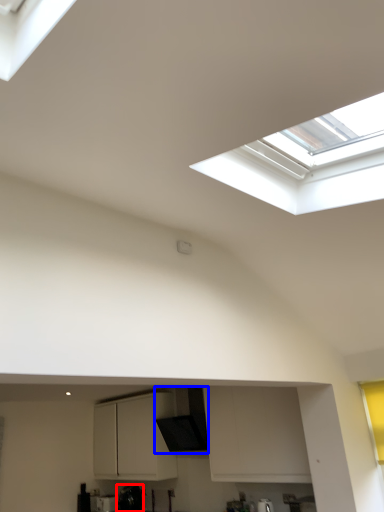
Question: Which point is closer to the camera, appliance (highlighted by a red box) or exhaust hood (highlighted by a blue box)?

Choices:
 (A) appliance
 (B) exhaust hood

Answer: (B)